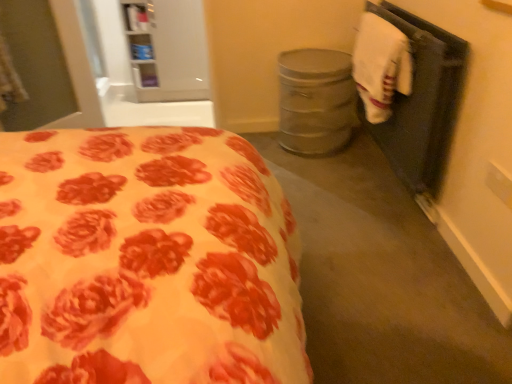
The width and height of the screenshot is (512, 384). What are the coordinates of `free space underneath white fabric at right (from a real-world perspective)` in the screenshot? It's located at (384, 176).